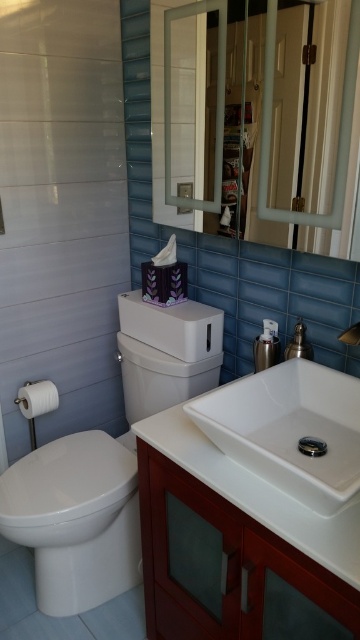
You are a bathroom designer planning to install a new fixture. You have a choice between placing a decorative vase or a towel rack. The decorative vase is the same size as the polished chrome faucet at upper right. The towel rack is the same size as the white glossy toilet bowl at lower left. Which item will take up more space in the bathroom?

The white glossy toilet bowl at lower left is larger in size than the polished chrome faucet at upper right. Since the towel rack is the same size as the white glossy toilet bowl at lower left, it will take up more space in the bathroom than the decorative vase, which matches the size of the polished chrome faucet at upper right.

You are a bathroom designer and need to ensure that the white glossy toilet bowl at lower left and the white glossy sink at center are proportionate to each other. Based on their sizes, which one should be placed in a larger space to maintain balance?

The white glossy toilet bowl at lower left is bigger than the white glossy sink at center, so it should be placed in a larger space to maintain balance.